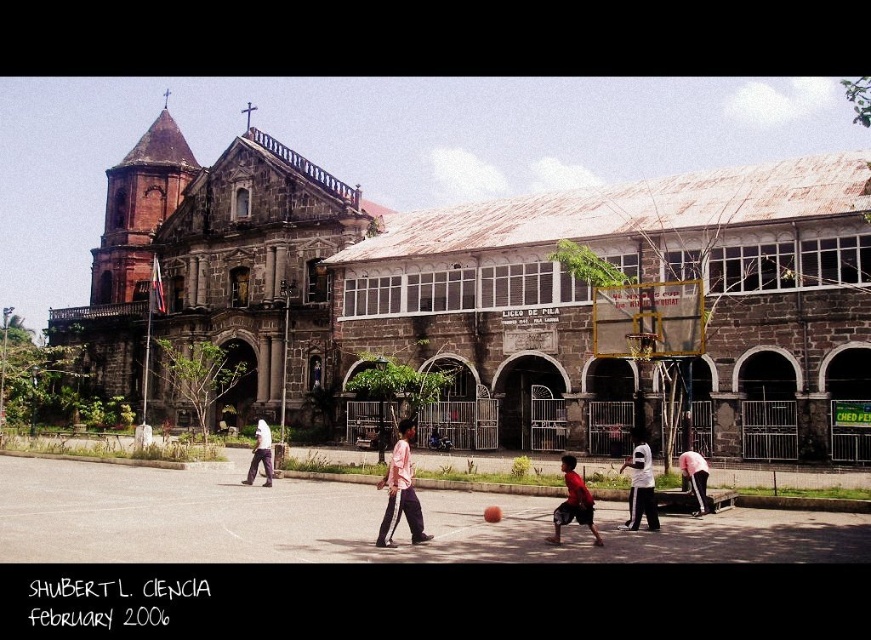
Question: Is white cotton shirt at center wider than red matte shirt at lower center?

Choices:
 (A) yes
 (B) no

Answer: (A)

Question: Is gold metallic basketball hoop at center thinner than light brown pants at center?

Choices:
 (A) no
 (B) yes

Answer: (B)

Question: Based on their relative distances, which object is farther from the pink fabric pants at center?

Choices:
 (A) gold metallic basketball hoop at center
 (B) dark brown stone church at upper left
 (C) white cotton shirt at center

Answer: (B)

Question: In this image, where is dark brown stone church at center located relative to white cotton shirt at center?

Choices:
 (A) right
 (B) left

Answer: (B)

Question: Which object appears closest to the camera in this image?

Choices:
 (A) red matte shirt at lower center
 (B) dark brown stone church at upper left
 (C) dark brown stone church at center

Answer: (A)

Question: Estimate the real-world distances between objects in this image. Which object is closer to the gold metallic basketball hoop at center?

Choices:
 (A) dark brown stone church at center
 (B) rubber basketball at center
 (C) dark brown stone church at upper left
 (D) red matte shirt at lower center

Answer: (D)